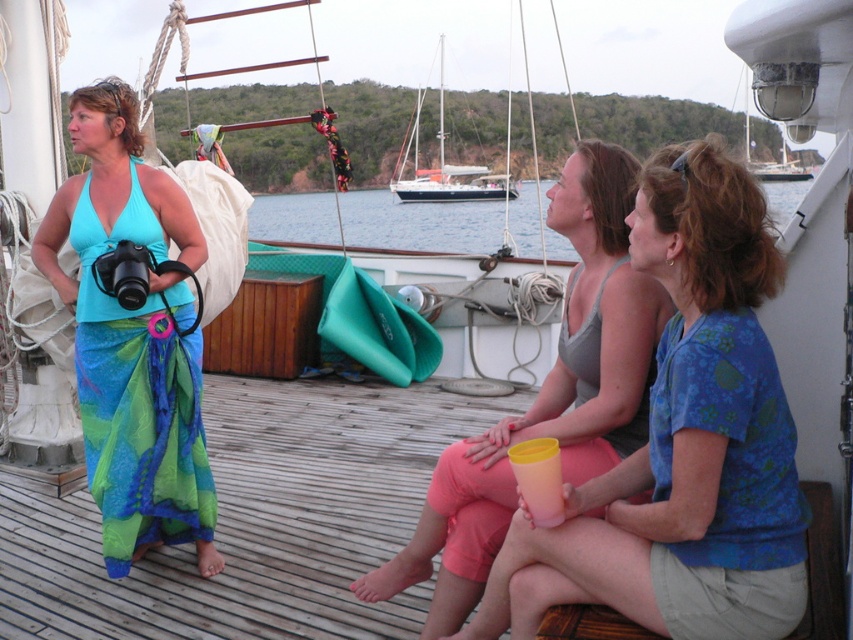
Question: Does matte blue shirt at center come in front of matte gray tank top at center?

Choices:
 (A) yes
 (B) no

Answer: (A)

Question: Is teal silk halter top at left below blue water at center?

Choices:
 (A) no
 (B) yes

Answer: (B)

Question: Which object is farther from the camera taking this photo?

Choices:
 (A) matte blue shirt at center
 (B) blue water at center
 (C) white sailboat at center

Answer: (C)

Question: Which of the following is the farthest from the observer?

Choices:
 (A) (422, 214)
 (B) (712, 412)

Answer: (A)

Question: Does teal silk halter top at left have a larger size compared to blue water at center?

Choices:
 (A) no
 (B) yes

Answer: (A)

Question: Which object appears closest to the camera in this image?

Choices:
 (A) teal silk halter top at left
 (B) blue water at center

Answer: (A)